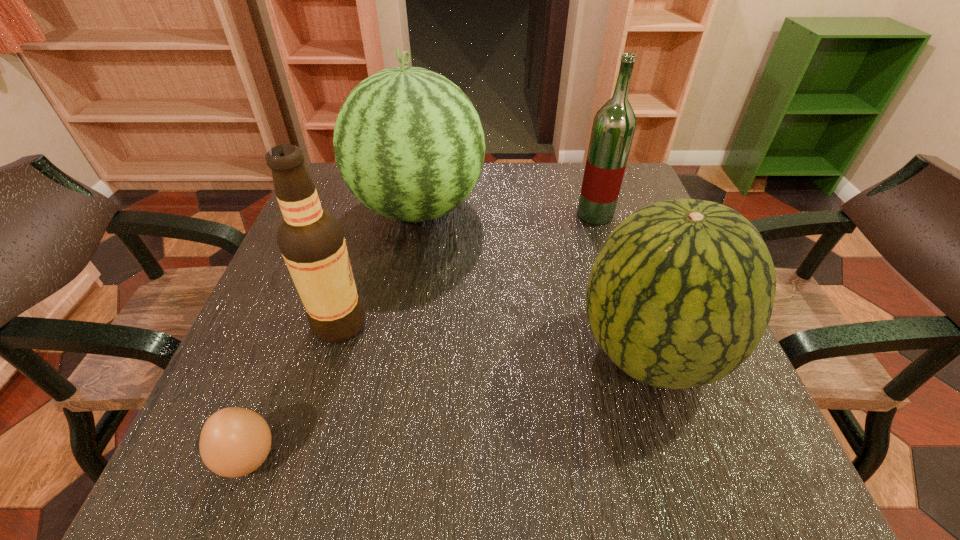
Where is `vacant space that satisfies the following two spatial constraints: 1. on the label of the alcohol; 2. on the right side of the nearer watermelon`? This screenshot has height=540, width=960. vacant space that satisfies the following two spatial constraints: 1. on the label of the alcohol; 2. on the right side of the nearer watermelon is located at coordinates (331, 353).

This screenshot has height=540, width=960. I want to click on vacant point that satisfies the following two spatial constraints: 1. on the back side of the shortest object; 2. on the left side of the shorter watermelon, so 290,353.

The height and width of the screenshot is (540, 960). Find the location of `vacant space that satisfies the following two spatial constraints: 1. on the back side of the fourth tallest object; 2. on the label of the alcohol`. vacant space that satisfies the following two spatial constraints: 1. on the back side of the fourth tallest object; 2. on the label of the alcohol is located at coordinates (639, 324).